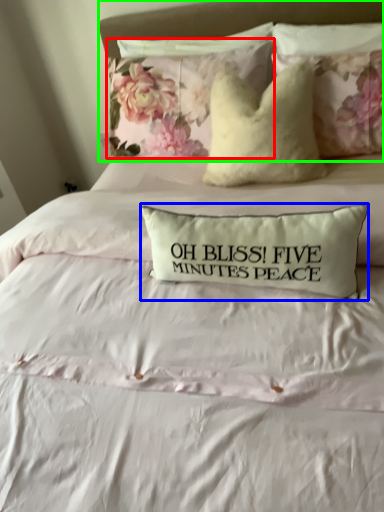
Question: Which object is the closest to the pillow (highlighted by a red box)? Choose among these: pillow (highlighted by a blue box) or headboard (highlighted by a green box).

Choices:
 (A) pillow
 (B) headboard

Answer: (B)